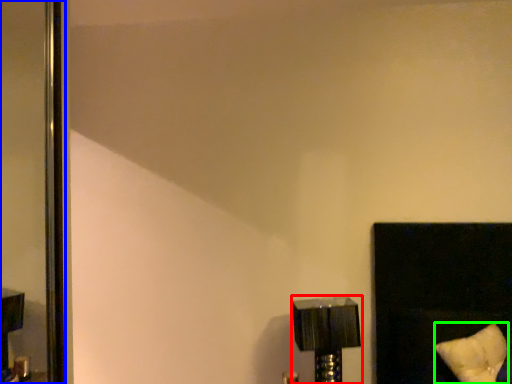
Question: Which object is positioned closest to lamp (highlighted by a red box)? Select from screen door (highlighted by a blue box) and pillow (highlighted by a green box).

Choices:
 (A) screen door
 (B) pillow

Answer: (B)